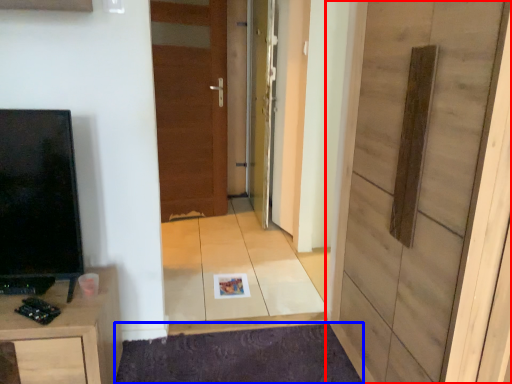
Question: Which of the following is the closest to the observer, door (highlighted by a red box) or doormat (highlighted by a blue box)?

Choices:
 (A) door
 (B) doormat

Answer: (A)